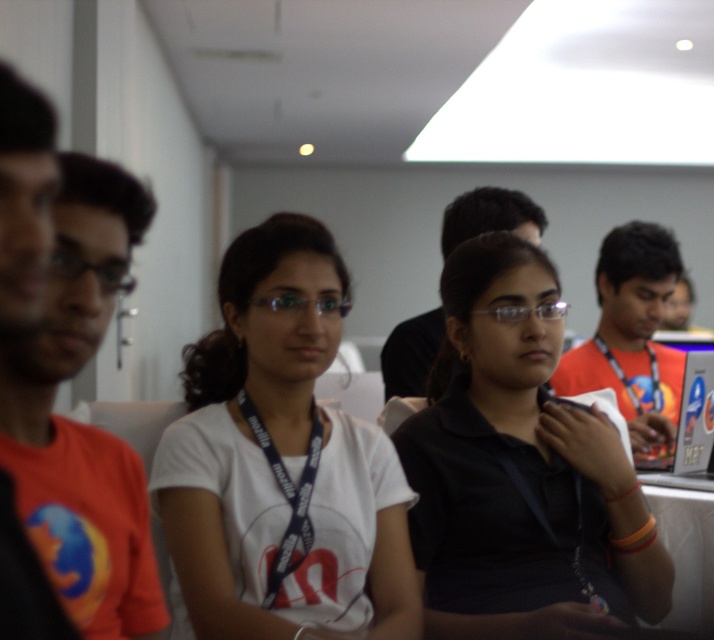
Question: Does black matte shirt at center lie in front of orange lanyard at center?

Choices:
 (A) yes
 (B) no

Answer: (A)

Question: Considering the real-world distances, which object is closest to the orange fabric shirt at left?

Choices:
 (A) orange lanyard at center
 (B) metallic silver table at lower right
 (C) white matte t-shirt at center

Answer: (C)

Question: In this image, where is black matte shirt at center located relative to orange lanyard at center?

Choices:
 (A) above
 (B) below

Answer: (B)

Question: Observing the image, what is the correct spatial positioning of white matte t-shirt at center in reference to black lanyard at center?

Choices:
 (A) left
 (B) right

Answer: (A)

Question: Among these points, which one is nearest to the camera?

Choices:
 (A) (685, 544)
 (B) (116, 445)
 (C) (473, 227)
 (D) (223, 586)

Answer: (B)

Question: Considering the real-world distances, which object is farthest from the orange fabric shirt at left?

Choices:
 (A) black matte shirt at center
 (B) orange lanyard at center
 (C) black lanyard at center
 (D) white matte t-shirt at center

Answer: (B)